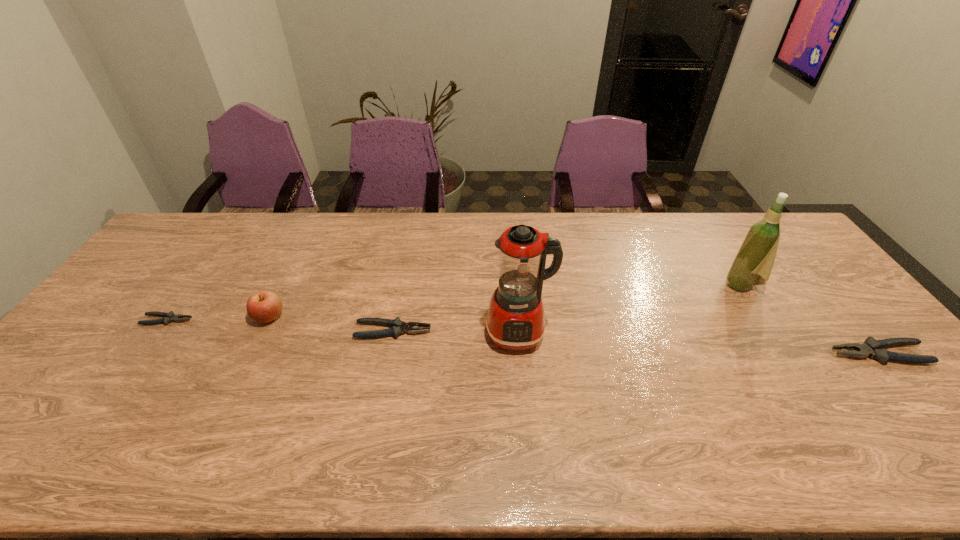
To achieve uniform spacing by inserting another pliers among them, please point to a free space for this new pliers. Please provide its 2D coordinates. Your answer should be formatted as a tuple, i.e. [(x, y)], where the tuple contains the x and y coordinates of a point satisfying the conditions above.

[(630, 342)]